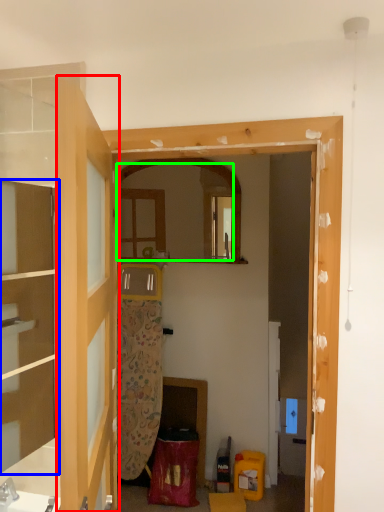
Question: Considering the real-world distances, which object is closest to door (highlighted by a red box)? cabinetry (highlighted by a blue box) or mirror (highlighted by a green box).

Choices:
 (A) cabinetry
 (B) mirror

Answer: (A)